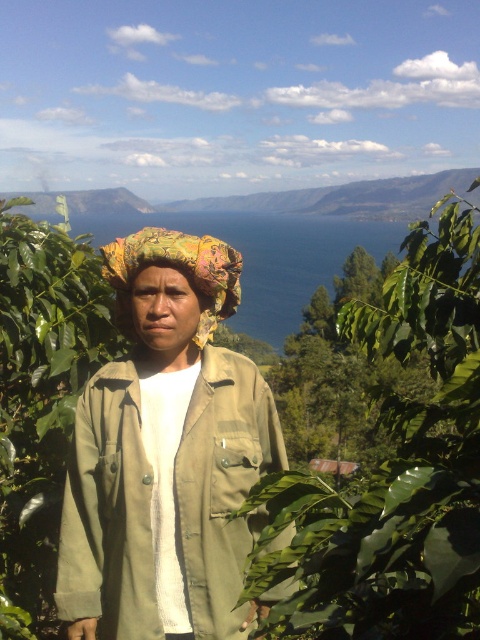
Question: Which point appears farthest from the camera in this image?

Choices:
 (A) (432, 598)
 (B) (116, 472)
 (C) (206, 252)

Answer: (C)

Question: Is olive green fabric trench coat at center smaller than printed fabric headscarf at center?

Choices:
 (A) no
 (B) yes

Answer: (B)

Question: Which point appears closest to the camera in this image?

Choices:
 (A) (372, 579)
 (B) (134, 628)

Answer: (A)

Question: Is olive green fabric trench coat at center thinner than printed fabric headscarf at center?

Choices:
 (A) no
 (B) yes

Answer: (B)

Question: In this image, where is green leafy plant at center located relative to olive green fabric trench coat at center?

Choices:
 (A) below
 (B) above

Answer: (A)

Question: Which object is the closest to the green leafy plant at center?

Choices:
 (A) olive green fabric trench coat at center
 (B) printed fabric headscarf at center

Answer: (A)